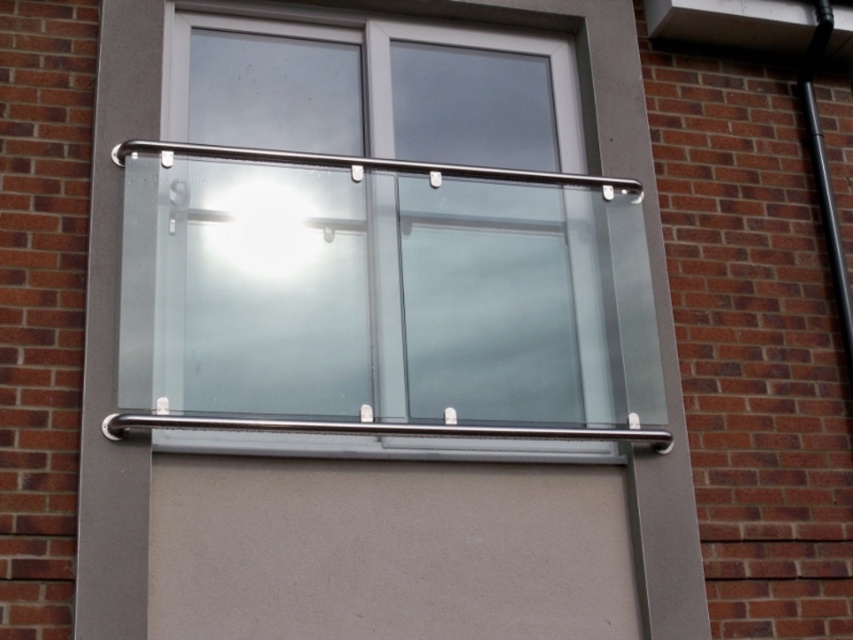
Question: Does clear glass window at center have a lesser width compared to satin stainless steel handrail at upper center?

Choices:
 (A) no
 (B) yes

Answer: (B)

Question: Which object is positioned closest to the clear glass window at center?

Choices:
 (A) satin stainless steel handrail at upper center
 (B) satin stainless steel handrail at center

Answer: (A)

Question: Does clear glass window at center have a larger size compared to satin stainless steel handrail at upper center?

Choices:
 (A) no
 (B) yes

Answer: (B)

Question: Which is nearer to the clear glass window at center?

Choices:
 (A) satin stainless steel handrail at center
 (B) satin stainless steel handrail at upper center

Answer: (B)

Question: Which object appears closest to the camera in this image?

Choices:
 (A) satin stainless steel handrail at center
 (B) clear glass window at center

Answer: (A)

Question: Can you confirm if clear glass window at center is smaller than satin stainless steel handrail at center?

Choices:
 (A) no
 (B) yes

Answer: (A)